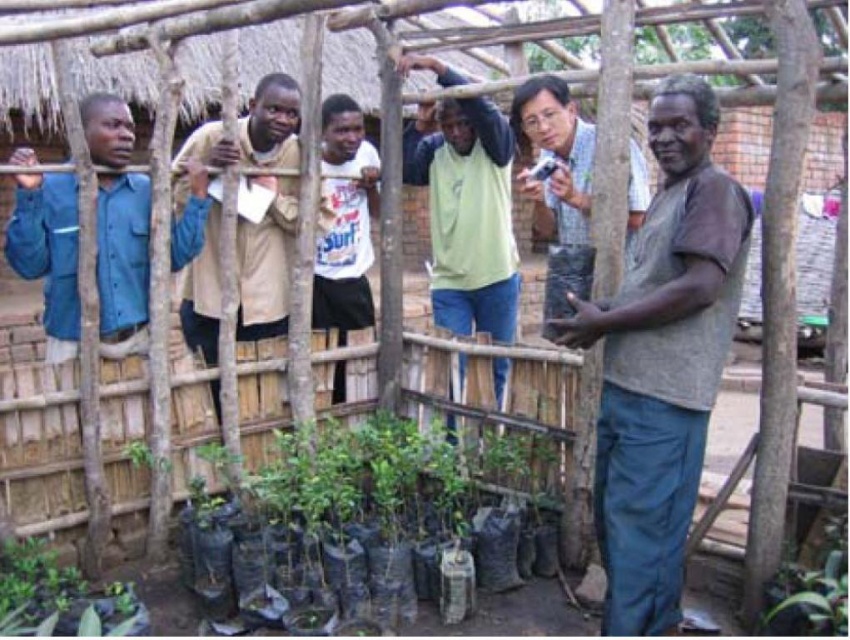
Where is `blue fabric shirt at left`? This screenshot has width=850, height=640. blue fabric shirt at left is located at coordinates (48, 252).

Based on the photo, is blue fabric shirt at left bigger than light blue shirt at upper center?

Indeed, blue fabric shirt at left has a larger size compared to light blue shirt at upper center.

Is point (42, 227) less distant than point (432, 122)?

Yes, point (42, 227) is in front of point (432, 122).

What are the coordinates of `blue fabric shirt at left` in the screenshot? It's located at (48, 252).

Is light brown shirt at center shorter than green matte plant at lower left?

No.

Which is behind, point (576, 122) or point (30, 561)?

Positioned behind is point (576, 122).

Between point (629, 211) and point (128, 632), which one is positioned behind?

The point (629, 211) is more distant.

Locate an element on the screen. This screenshot has height=640, width=850. light brown shirt at center is located at coordinates (554, 157).

Is point (284, 499) positioned behind point (136, 632)?

Yes, point (284, 499) is behind point (136, 632).

Does green matte plant at lower center have a lesser width compared to green matte plant at lower left?

In fact, green matte plant at lower center might be wider than green matte plant at lower left.

Does point (459, 515) come in front of point (106, 608)?

That is False.

Locate an element on the screen. This screenshot has height=640, width=850. green matte plant at lower center is located at coordinates (338, 524).